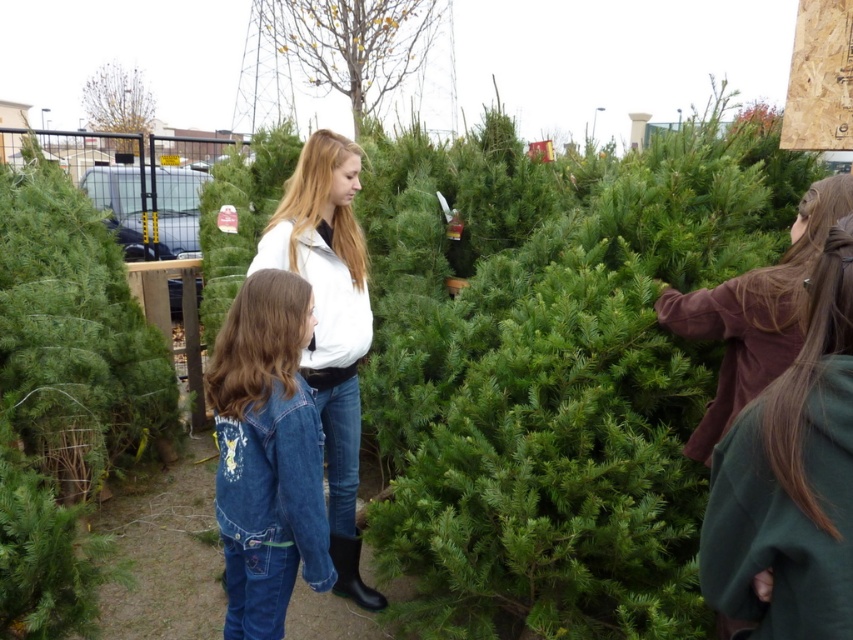
You are a delivery person trying to carry a package through the path between the white matte jacket at center and the smooth bark tree at upper center. The package is 10 cm thick. Can you fit through the space?

The white matte jacket at center is thinner than the smooth bark tree at upper center. Since the package is 10 cm thick, it depends on the actual width of the path. However, the description only states the relative thickness between the two objects, not the exact dimensions of the path. Without knowing the exact width of the path, we cannot confirm if the package will fit. Please measure the path width before attempting to pass.

You are standing in front of the Christmas tree lot and want to take a photo of the two points marked in the scene. Which point, point 1 at position (753, 449) or point 2 at position (334, 230), will appear larger in your camera view?

Point 1 at position (753, 449) will appear larger in the camera view because it is closer to the camera than point 2 at position (334, 230).

In the scene shown: You are a delivery person who needs to transport both the green matte christmas tree at left and the denim jacket at lower left. Based on their sizes, which item will require more space in your delivery van?

The green matte christmas tree at left is bigger than the denim jacket at lower left, so it will require more space in the delivery van.